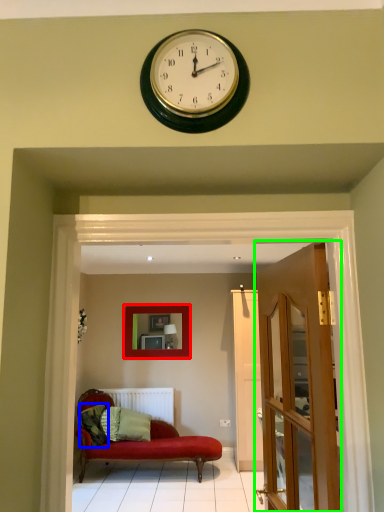
Question: Based on their relative distances, which object is nearer to picture frame (highlighted by a red box)? Choose from pillow (highlighted by a blue box) and door (highlighted by a green box).

Choices:
 (A) pillow
 (B) door

Answer: (A)